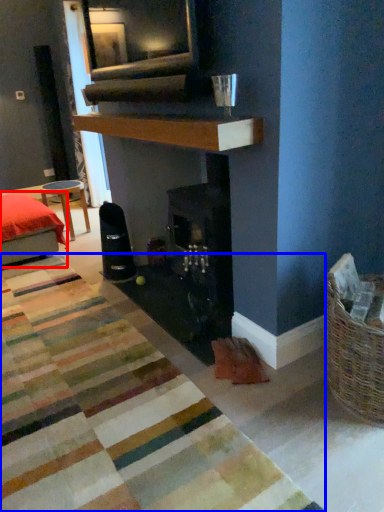
Question: Which of the following is the farthest to the observer, furniture (highlighted by a red box) or mat (highlighted by a blue box)?

Choices:
 (A) furniture
 (B) mat

Answer: (A)